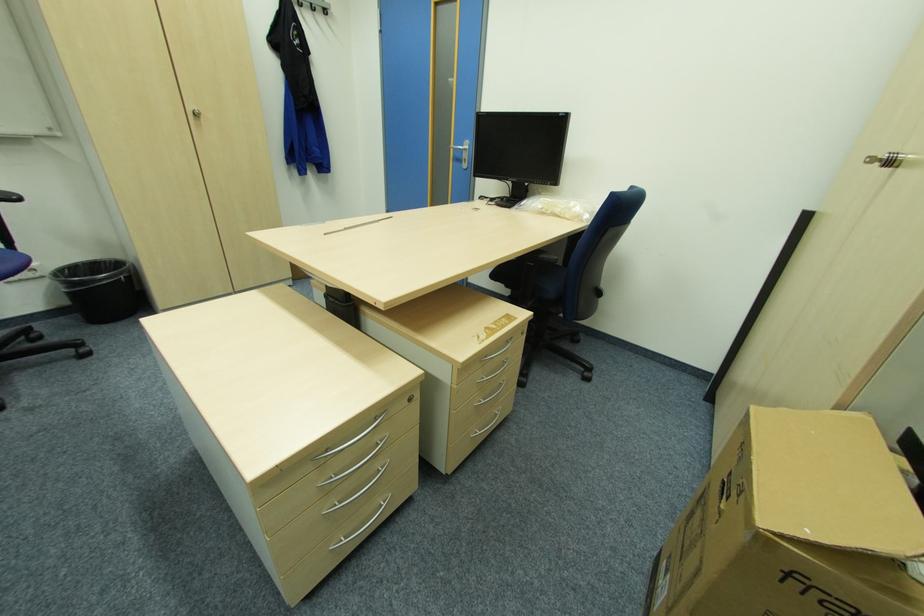
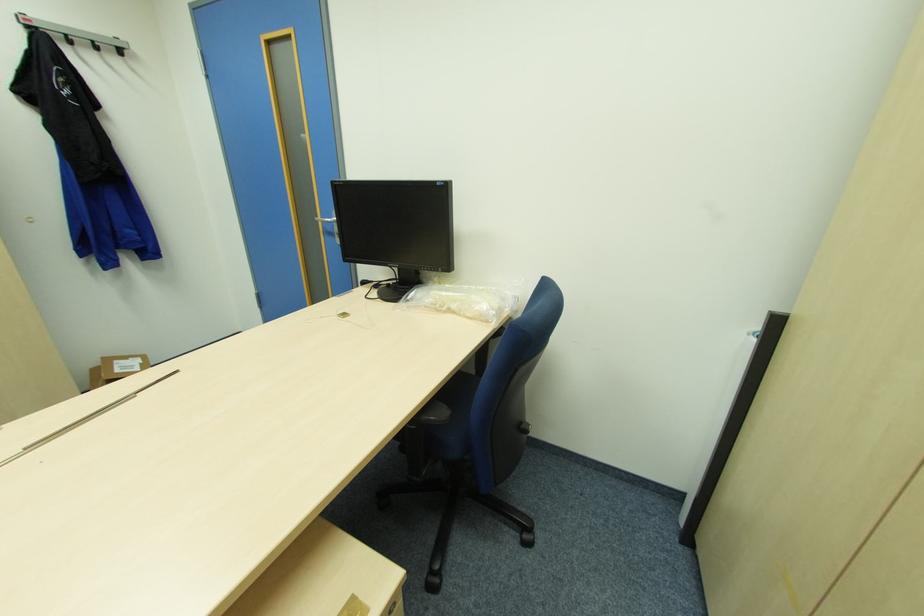
Which direction would the cameraman need to move to produce the second image?

The cameraman moved toward right, forward.